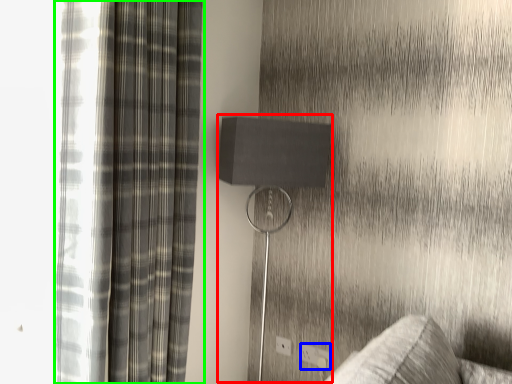
Question: Estimate the real-world distances between objects in this image. Which object is closer to table lamp (highlighted by a red box), electric outlet (highlighted by a blue box) or curtain (highlighted by a green box)?

Choices:
 (A) electric outlet
 (B) curtain

Answer: (B)